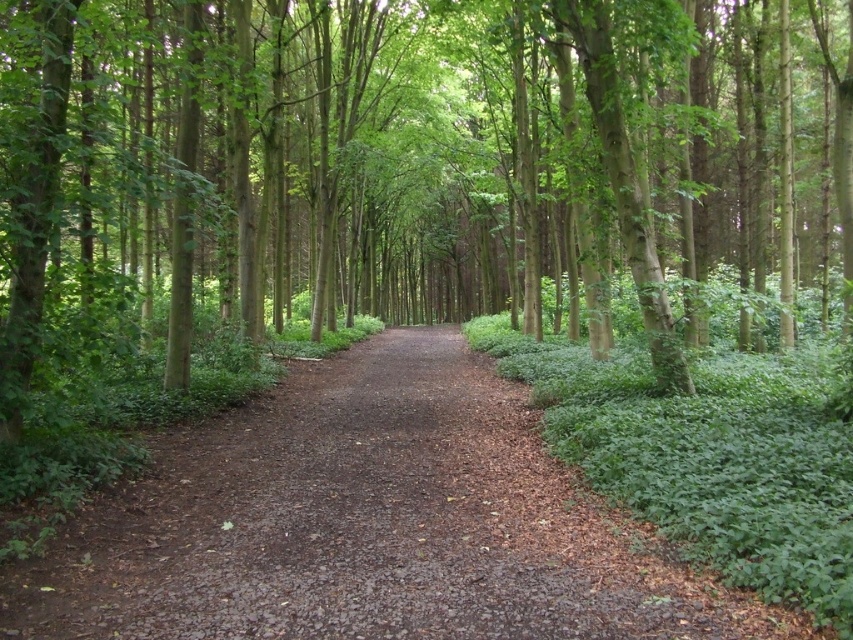
Question: Which point appears closest to the camera in this image?

Choices:
 (A) (68, 314)
 (B) (190, 502)

Answer: (B)

Question: Can you confirm if green matte tree at center is positioned below brown dirt path at center?

Choices:
 (A) yes
 (B) no

Answer: (B)

Question: Does green matte tree at center appear on the right side of brown dirt path at center?

Choices:
 (A) no
 (B) yes

Answer: (B)

Question: Does green matte tree at center appear on the right side of brown dirt path at center?

Choices:
 (A) no
 (B) yes

Answer: (B)